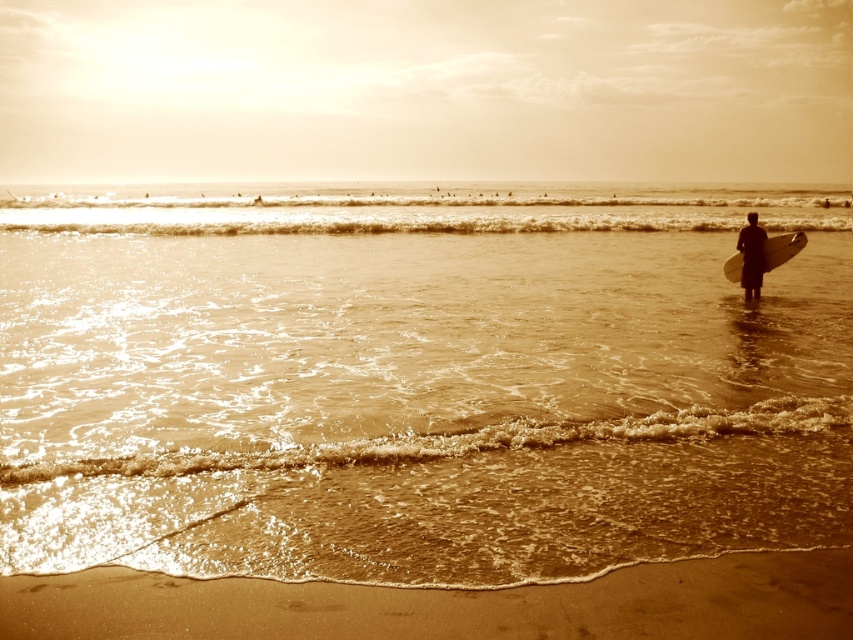
The height and width of the screenshot is (640, 853). Identify the location of brown water at center. (416, 385).

Is brown water at center below sandy brown sand at lower center?

No.

Describe the element at coordinates (416, 385) in the screenshot. I see `brown water at center` at that location.

You are a GUI agent. You are given a task and a screenshot of the screen. Output one action in this format:
    pyautogui.click(x=<x>, y=<y>)
    Task: Click on the brown water at center
    This screenshot has height=640, width=853.
    Given the screenshot: What is the action you would take?
    pyautogui.click(x=416, y=385)

You are a GUI agent. You are given a task and a screenshot of the screen. Output one action in this format:
    pyautogui.click(x=<x>, y=<y>)
    Task: Click on the sandy brown sand at lower center
    Image resolution: width=853 pixels, height=640 pixels.
    Given the screenshot: What is the action you would take?
    pyautogui.click(x=450, y=604)

Who is higher up, sandy brown sand at lower center or black matte surfboard at right?

black matte surfboard at right is higher up.

Locate an element on the screen. Image resolution: width=853 pixels, height=640 pixels. sandy brown sand at lower center is located at coordinates (450, 604).

Locate an element on the screen. The image size is (853, 640). sandy brown sand at lower center is located at coordinates (450, 604).

Can you confirm if sandy brown sand at lower center is positioned to the left of white matte surfboard at right?

Correct, you'll find sandy brown sand at lower center to the left of white matte surfboard at right.

Is sandy brown sand at lower center to the right of white matte surfboard at right from the viewer's perspective?

No, sandy brown sand at lower center is not to the right of white matte surfboard at right.

Does point (25, 588) come farther from viewer compared to point (770, 253)?

No, it is not.

I want to click on sandy brown sand at lower center, so click(x=450, y=604).